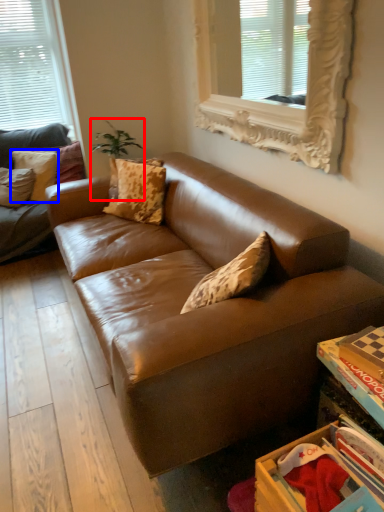
Question: Which point is closer to the camera, plant (highlighted by a red box) or pillow (highlighted by a blue box)?

Choices:
 (A) plant
 (B) pillow

Answer: (A)